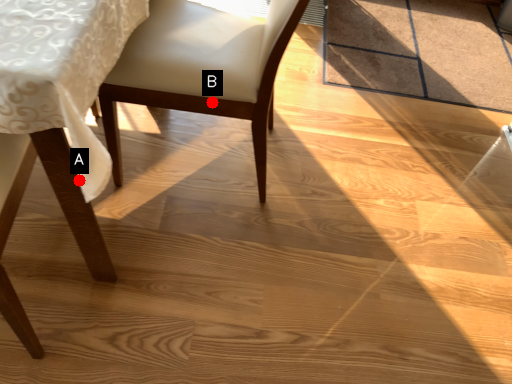
Question: Two points are circled on the image, labeled by A and B beside each circle. Which point appears farthest from the camera in this image?

Choices:
 (A) A is further
 (B) B is further

Answer: (B)